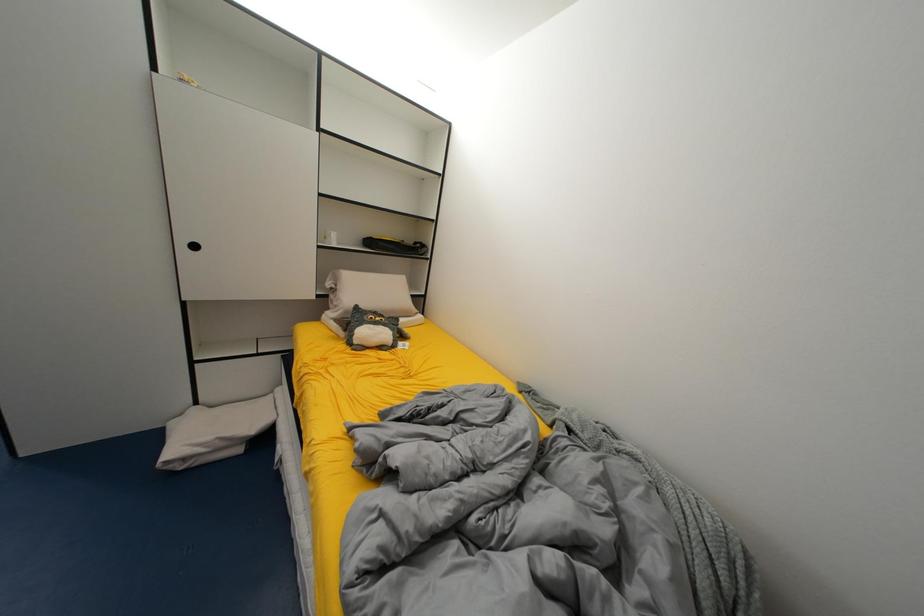
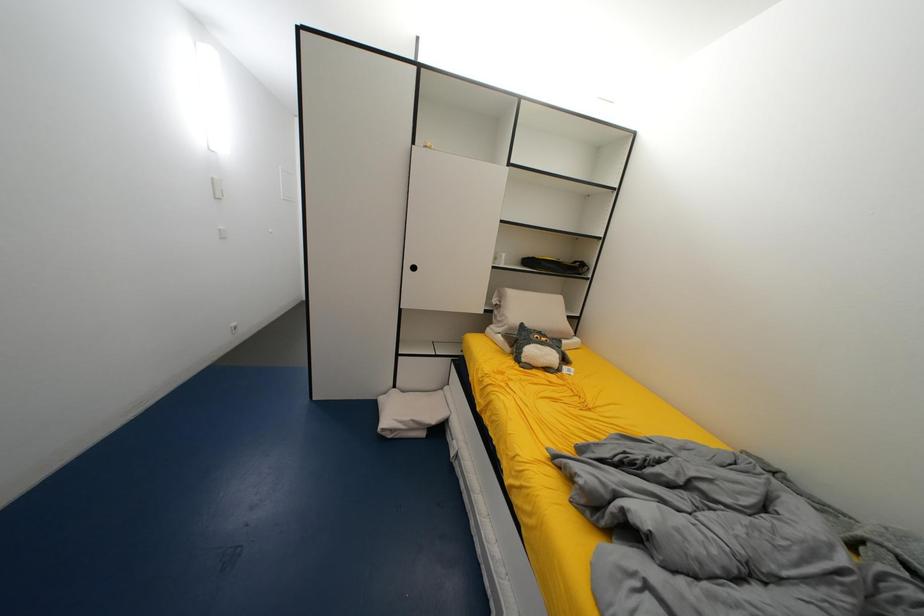
Question: Based on the continuous images, in which direction is the camera rotating? Reply with the corresponding letter.

Choices:
 (A) Left
 (B) Right
 (C) Up
 (D) Down

Answer: (A)